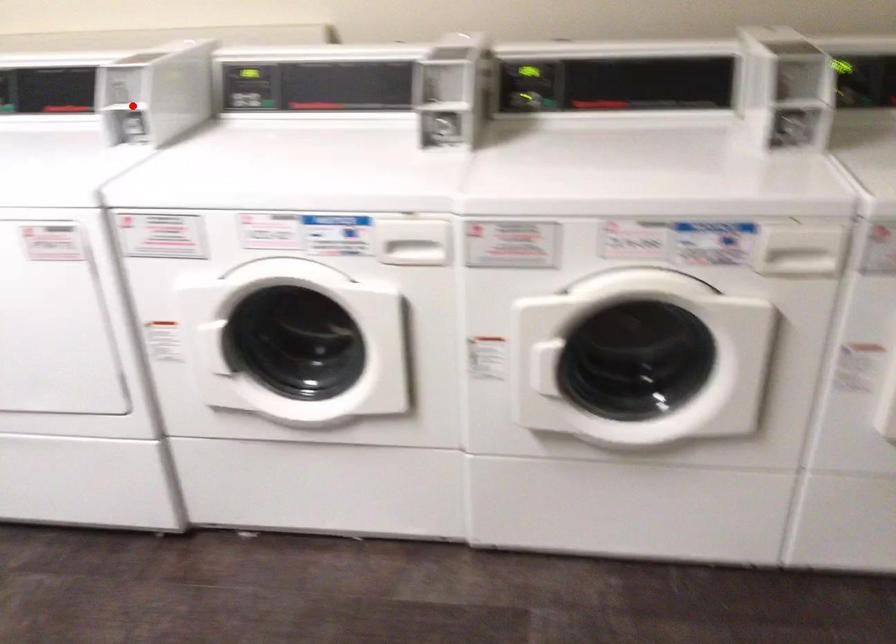
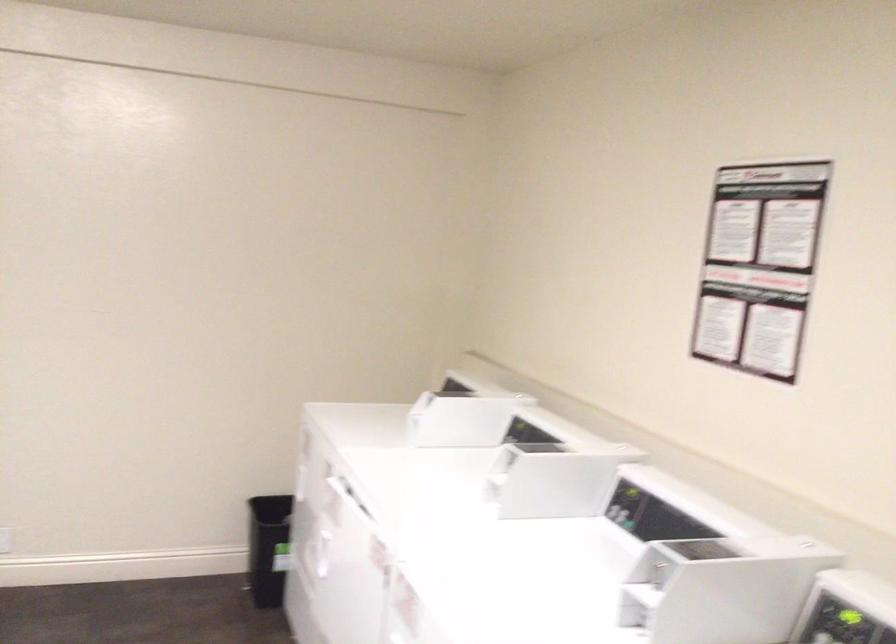
Question: A red point is marked in image1. In image2, is the corresponding 3D point closer to the camera or farther? Reply with the corresponding letter.

Choices:
 (A) The corresponding 3D point is closer.
 (B) The corresponding 3D point is farther.

Answer: (A)